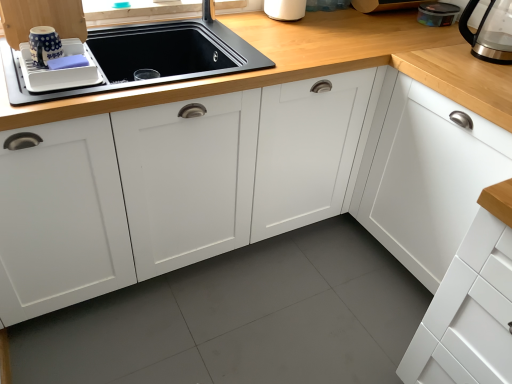
Where is `free location to the right of blue dotted cup at upper left, which is the third appliance from back to front`? The height and width of the screenshot is (384, 512). free location to the right of blue dotted cup at upper left, which is the third appliance from back to front is located at coordinates (94, 78).